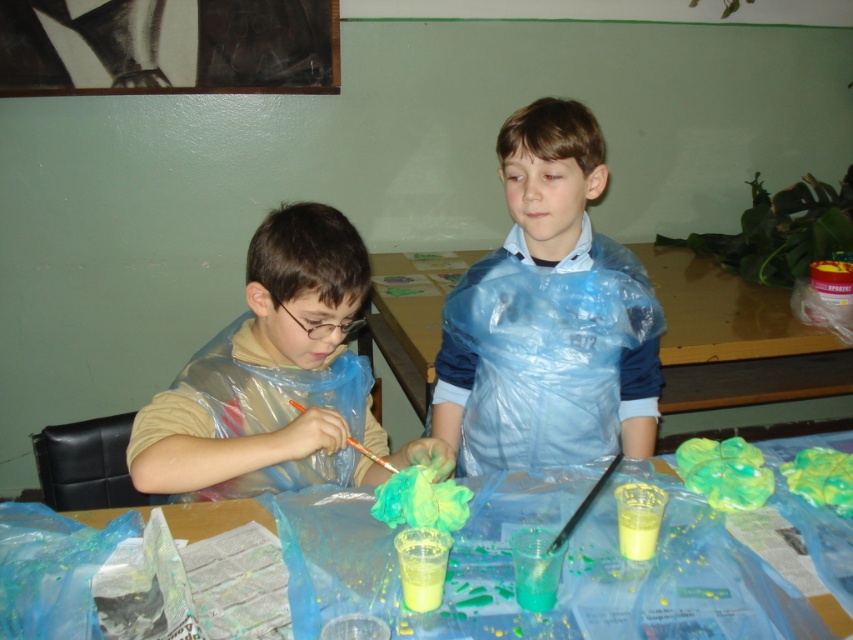
Question: Does translucent plastic table at center lie behind matte plastic apron at left?

Choices:
 (A) no
 (B) yes

Answer: (A)

Question: Which object is positioned closest to the translucent plastic table at center?

Choices:
 (A) matte plastic apron at left
 (B) wooden table at center

Answer: (A)

Question: Which is nearer to the translucent plastic table at center?

Choices:
 (A) blue plastic bag at center
 (B) wooden table at center
 (C) matte plastic apron at left

Answer: (C)

Question: Does translucent plastic table at center come in front of wooden table at center?

Choices:
 (A) no
 (B) yes

Answer: (B)

Question: Does translucent plastic table at center have a lesser width compared to blue plastic bag at center?

Choices:
 (A) no
 (B) yes

Answer: (A)

Question: Which point is closer to the camera?

Choices:
 (A) (312, 566)
 (B) (628, 376)
 (C) (432, 333)

Answer: (A)